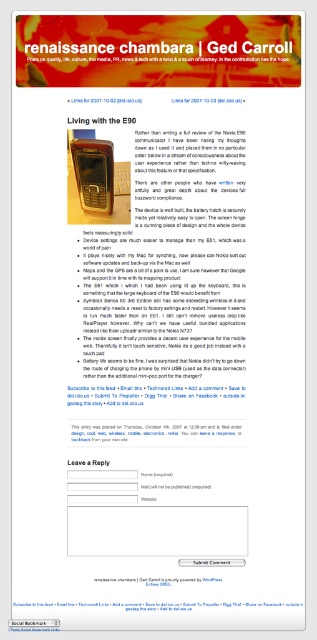
Question: Can you confirm if white paper at center is thinner than brown leather wallet at upper center?

Choices:
 (A) no
 (B) yes

Answer: (A)

Question: Can you confirm if white paper at upper center is positioned below white paper at center?

Choices:
 (A) yes
 (B) no

Answer: (A)

Question: Estimate the real-world distances between objects in this image. Which object is farther from the white paper at upper center?

Choices:
 (A) white paper at center
 (B) brown leather wallet at upper center

Answer: (B)

Question: Is white paper at upper center in front of brown leather wallet at upper center?

Choices:
 (A) no
 (B) yes

Answer: (B)

Question: Considering the real-world distances, which object is closest to the white paper at center?

Choices:
 (A) white paper at upper center
 (B) brown leather wallet at upper center

Answer: (A)

Question: Which point is closer to the camera taking this photo?

Choices:
 (A) (188, 580)
 (B) (130, 122)

Answer: (A)